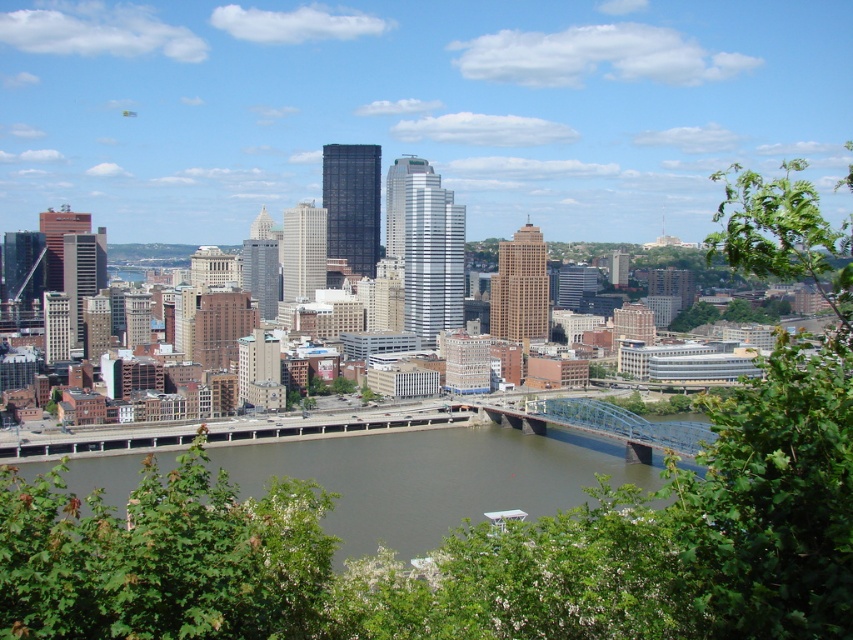
Which is above, brown concrete river at center or blue metallic bridge at center?

blue metallic bridge at center

Between brown concrete river at center and blue metallic bridge at center, which one is positioned lower?

brown concrete river at center is lower down.

You are a GUI agent. You are given a task and a screenshot of the screen. Output one action in this format:
    pyautogui.click(x=<x>, y=<y>)
    Task: Click on the brown concrete river at center
    This screenshot has width=853, height=640.
    Given the screenshot: What is the action you would take?
    pyautogui.click(x=433, y=477)